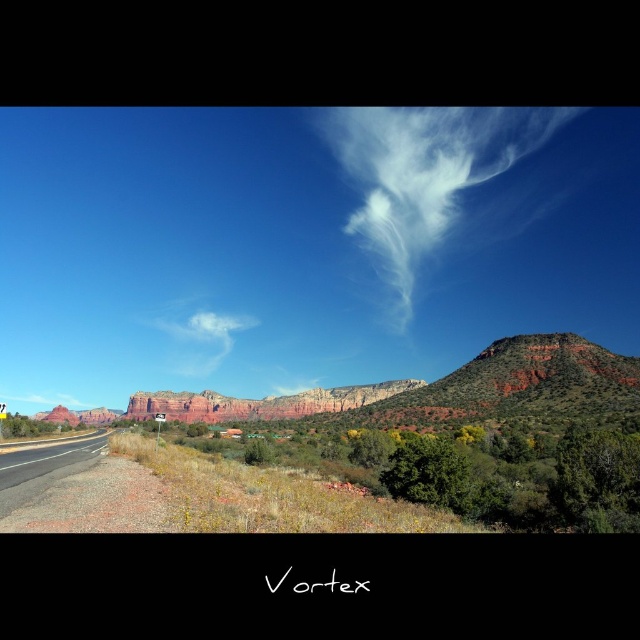
Does white cotton cloud at upper center appear on the left side of reddish-brown rocky mountain at center-right?

No, white cotton cloud at upper center is not to the left of reddish-brown rocky mountain at center-right.

Is white cotton cloud at upper center closer to the viewer compared to reddish-brown rocky mountain at center-right?

No, white cotton cloud at upper center is behind reddish-brown rocky mountain at center-right.

Where is `white cotton cloud at upper center`? The height and width of the screenshot is (640, 640). white cotton cloud at upper center is located at coordinates (422, 173).

At what (x,y) coordinates should I click in order to perform the action: click on white cotton cloud at upper center. Please return your answer as a coordinate pair (x, y). The width and height of the screenshot is (640, 640). Looking at the image, I should click on (422, 173).

Is white cotton cloud at upper center smaller than black asphalt highway at lower left?

Actually, white cotton cloud at upper center might be larger than black asphalt highway at lower left.

This screenshot has height=640, width=640. What do you see at coordinates (422, 173) in the screenshot?
I see `white cotton cloud at upper center` at bounding box center [422, 173].

Measure the distance between point [420,250] and camera.

Point [420,250] is 494.79 meters from camera.

You are a GUI agent. You are given a task and a screenshot of the screen. Output one action in this format:
    pyautogui.click(x=<x>, y=<y>)
    Task: Click on the white cotton cloud at upper center
    The image size is (640, 640).
    Given the screenshot: What is the action you would take?
    pyautogui.click(x=422, y=173)

Consider the image. Who is positioned more to the left, reddish-brown rocky mountain at center-right or white cotton cloud at center?

white cotton cloud at center

Who is shorter, reddish-brown rocky mountain at center-right or white cotton cloud at center?

Standing shorter between the two is reddish-brown rocky mountain at center-right.

What do you see at coordinates (512, 387) in the screenshot?
I see `reddish-brown rocky mountain at center-right` at bounding box center [512, 387].

This screenshot has height=640, width=640. What are the coordinates of `reddish-brown rocky mountain at center-right` in the screenshot? It's located at point(512,387).